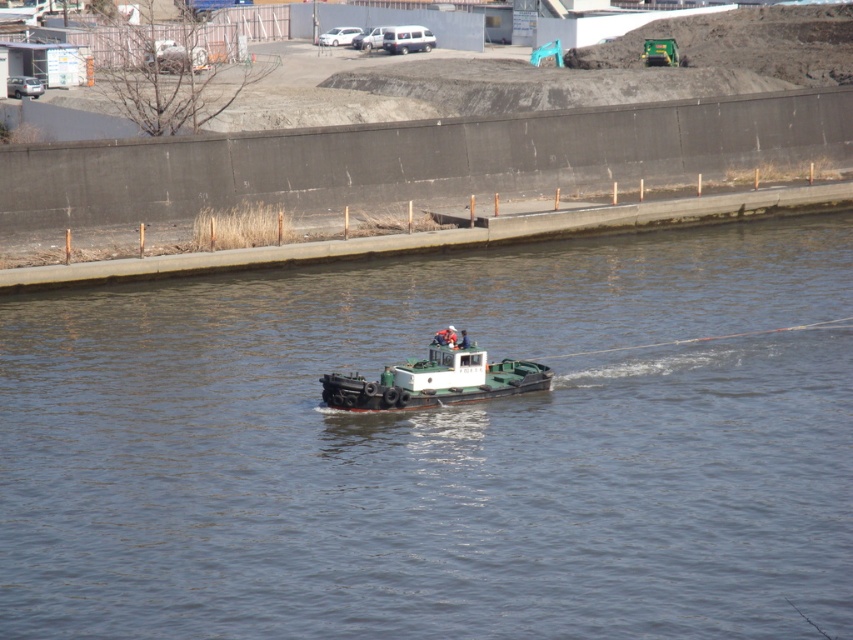
Question: Which object appears closest to the camera in this image?

Choices:
 (A) green matte boat at center
 (B) white matte boat at center

Answer: (A)

Question: Which object is closer to the camera taking this photo?

Choices:
 (A) white matte boat at center
 (B) green matte boat at center

Answer: (B)

Question: Can you confirm if green matte boat at center is positioned to the right of white matte boat at center?

Choices:
 (A) no
 (B) yes

Answer: (A)

Question: Does green matte boat at center appear under white matte boat at center?

Choices:
 (A) no
 (B) yes

Answer: (A)

Question: Is green matte boat at center bigger than white matte boat at center?

Choices:
 (A) yes
 (B) no

Answer: (A)